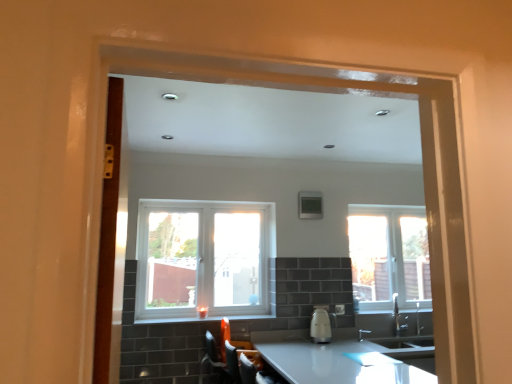
At what (x,y) coordinates should I click in order to perform the action: click on vacant location below white glossy window sill at center (from a real-world perspective). Please return your answer as a coordinate pair (x, y). Image resolution: width=512 pixels, height=384 pixels. Looking at the image, I should click on (218, 319).